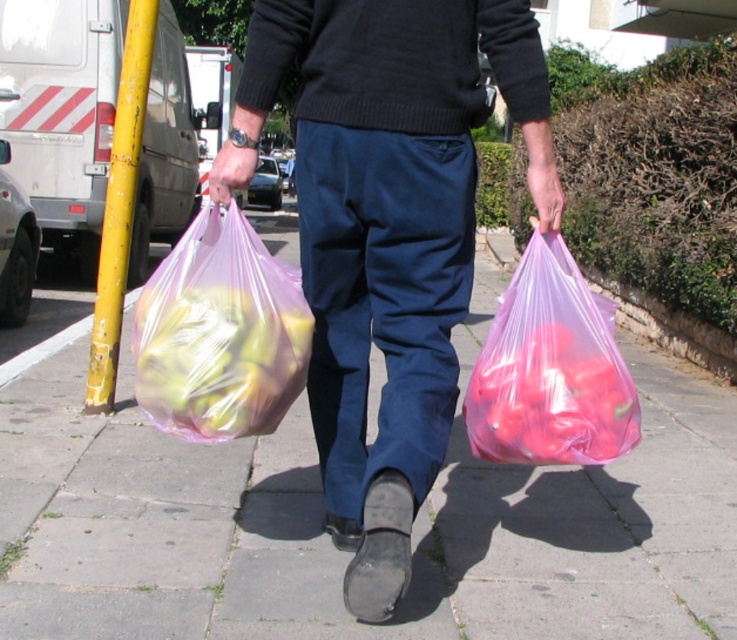
You are a photographer trying to capture the two points in the image. Which point is closer to the camera, point [189,467] or point [492,36]?

Point [189,467] is closer to the camera than point [492,36].

You are a delivery person who needs to place a small package in the exact location of the point marked at coordinates (349, 556). Based on the scene description, what object is currently occupying that location?

The point at coordinates (349, 556) corresponds to the transparent plastic bag at center, so the transparent plastic bag at center is currently occupying that location.

Based on the photo, you are a delivery person who needs to park your white matte van at left in a parking spot that is the same size as the translucent pink plastic bag at lower right. Can your van fit in the parking spot?

The white matte van at left is wider than the translucent pink plastic bag at lower right, so it cannot fit in a parking spot that is the same size as the bag.